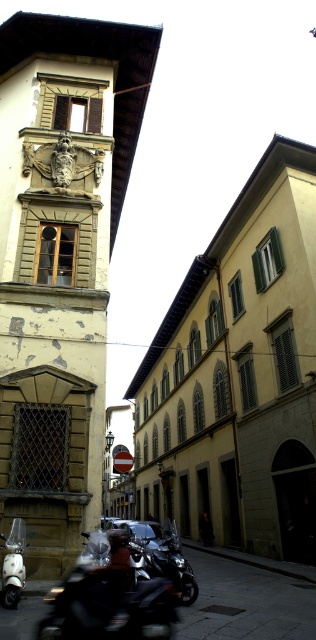
Between yellowish stone tower at center and metallic silver scooter at lower left, which one has less height?

Standing shorter between the two is metallic silver scooter at lower left.

Is yellowish stone tower at center shorter than metallic silver scooter at lower left?

In fact, yellowish stone tower at center may be taller than metallic silver scooter at lower left.

Where is `yellowish stone tower at center`? This screenshot has width=316, height=640. yellowish stone tower at center is located at coordinates click(x=60, y=260).

Identify the location of yellowish stone tower at center. (60, 260).

Is shiny black motorcycle at lower left shorter than metallic silver scooter at lower left?

Correct, shiny black motorcycle at lower left is not as tall as metallic silver scooter at lower left.

Is shiny black motorcycle at lower left positioned before metallic silver scooter at lower left?

Yes, it is in front of metallic silver scooter at lower left.

Where is `shiny black motorcycle at lower left`? The height and width of the screenshot is (640, 316). shiny black motorcycle at lower left is located at coordinates (109, 598).

Can you confirm if yellowish stone tower at center is positioned above shiny black motorcycle at lower left?

Yes, yellowish stone tower at center is above shiny black motorcycle at lower left.

This screenshot has height=640, width=316. I want to click on yellowish stone tower at center, so point(60,260).

Measure the distance between point [85,120] and camera.

Point [85,120] is 20.47 meters from camera.

I want to click on yellowish stone tower at center, so click(60, 260).